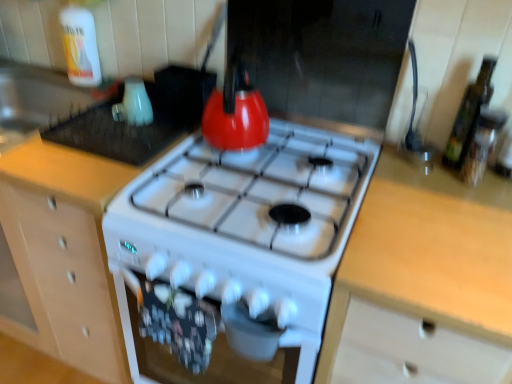
Question: Is light wood countertop at right behind white glossy kettle at upper left, placed as the 2th appliance when sorted from right to left?

Choices:
 (A) yes
 (B) no

Answer: (B)

Question: Is light wood countertop at right aimed at white glossy kettle at upper left, placed as the 2th appliance when sorted from right to left?

Choices:
 (A) yes
 (B) no

Answer: (B)

Question: From a real-world perspective, is light wood countertop at right beneath white glossy kettle at upper left, placed as the 2th appliance when sorted from right to left?

Choices:
 (A) yes
 (B) no

Answer: (A)

Question: Is the depth of light wood countertop at right less than that of white glossy kettle at upper left, placed as the 2th appliance when sorted from right to left?

Choices:
 (A) no
 (B) yes

Answer: (B)

Question: Is light wood countertop at right smaller than white glossy kettle at upper left, the 1th appliance when ordered from left to right?

Choices:
 (A) no
 (B) yes

Answer: (A)

Question: Is light wood countertop at right touching white glossy kettle at upper left, placed as the 2th appliance when sorted from right to left?

Choices:
 (A) yes
 (B) no

Answer: (B)

Question: From a real-world perspective, is matte white kettle at upper left, the first appliance from the right, below green glass bottle at right, the 2th bottle from the top?

Choices:
 (A) no
 (B) yes

Answer: (B)

Question: Is matte white kettle at upper left, the first appliance from the right, further to the viewer compared to green glass bottle at right, the 2th bottle from the top?

Choices:
 (A) yes
 (B) no

Answer: (A)

Question: Does matte white kettle at upper left, the first appliance from the right, have a lesser height compared to green glass bottle at right, the second bottle viewed from the left?

Choices:
 (A) no
 (B) yes

Answer: (B)

Question: From a real-world perspective, is matte white kettle at upper left, marked as the 2th appliance in a left-to-right arrangement, on top of green glass bottle at right, the 2th bottle from the top?

Choices:
 (A) yes
 (B) no

Answer: (B)

Question: Can you confirm if matte white kettle at upper left, the first appliance from the right, is bigger than green glass bottle at right, the 2th bottle in the back-to-front sequence?

Choices:
 (A) no
 (B) yes

Answer: (B)

Question: Is matte white kettle at upper left, marked as the 2th appliance in a left-to-right arrangement, wider than green glass bottle at right, the 1th bottle viewed from the right?

Choices:
 (A) no
 (B) yes

Answer: (B)

Question: Can you confirm if wooden cabinet at center is thinner than matte white kettle at upper left, the first appliance from the right?

Choices:
 (A) yes
 (B) no

Answer: (B)